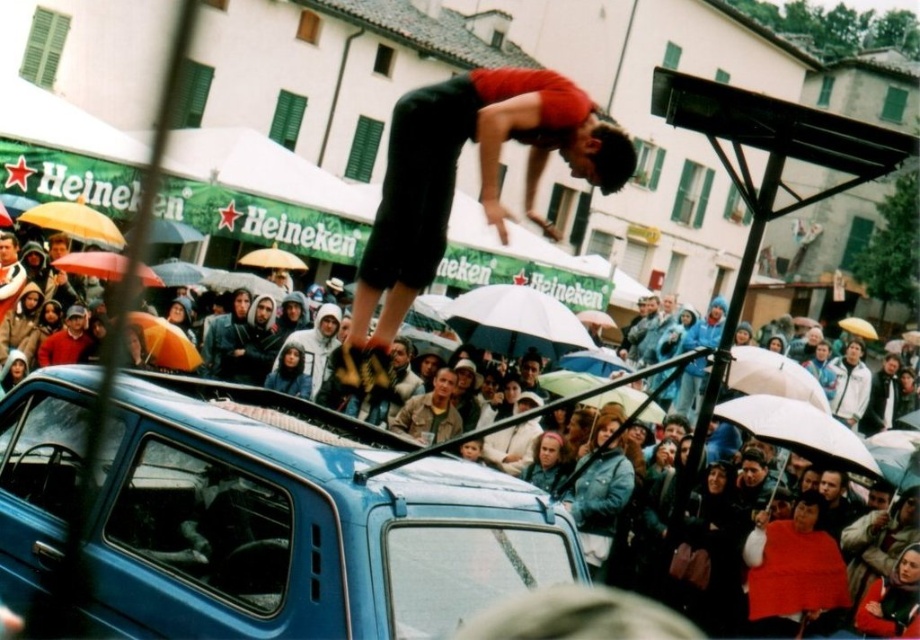
What is the color of the car located at the point with coordinates (299, 522) in the image?

The point at coordinates (299, 522) indicates the blue matte car at center, so the color is blue.

You are a photographer trying to capture the central figure performing a backflip over the blue car. You notice the matte black jacket at center and the white matte umbrella at center in your shot. Which object should you adjust your focus to ensure the central figure is sharp? Explain your reasoning.

The matte black jacket at center is closer to the viewer than the white matte umbrella at center. To ensure the central figure performing the backflip is in focus, you should adjust your focus to the matte black jacket at center because it is closer, and focusing on it will help maintain sharpness for the central figure who is also near that plane.

You are a photographer trying to capture the man performing a backflip over the blue car in the image. You need to focus your camera on the matte black jacket at center. What are the coordinates where you should aim your camera?

The coordinates for the matte black jacket at center are at point (297, 524).